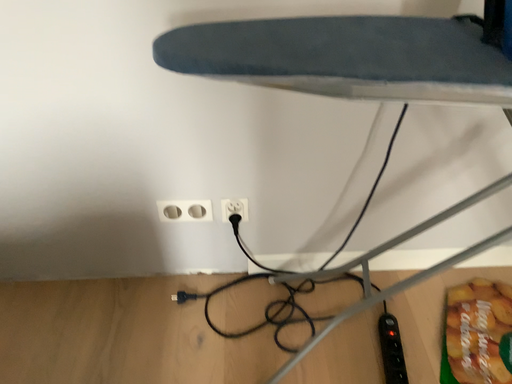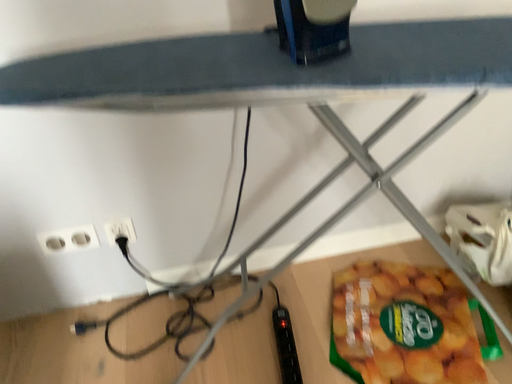
Question: Which way did the camera rotate in the video?

Choices:
 (A) rotated right
 (B) rotated left

Answer: (A)